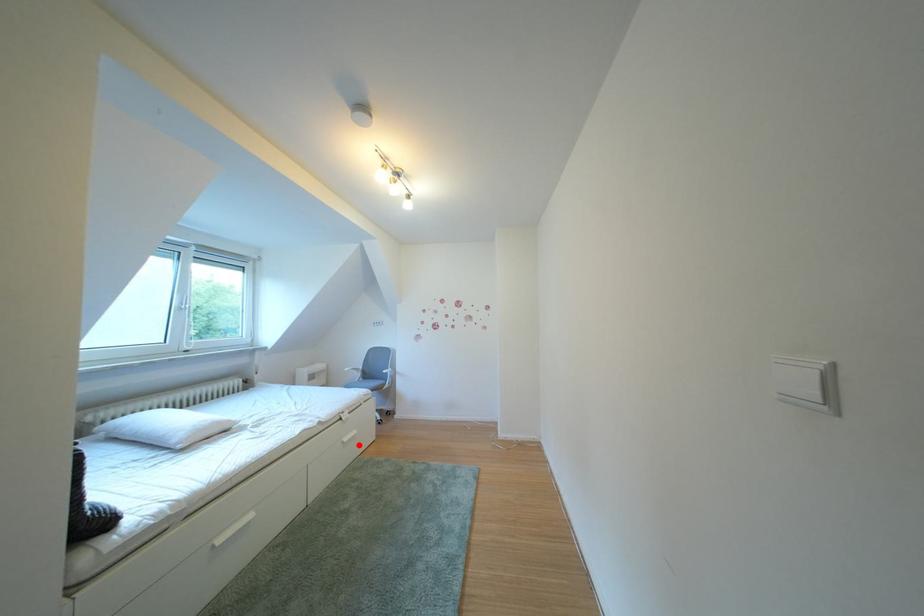
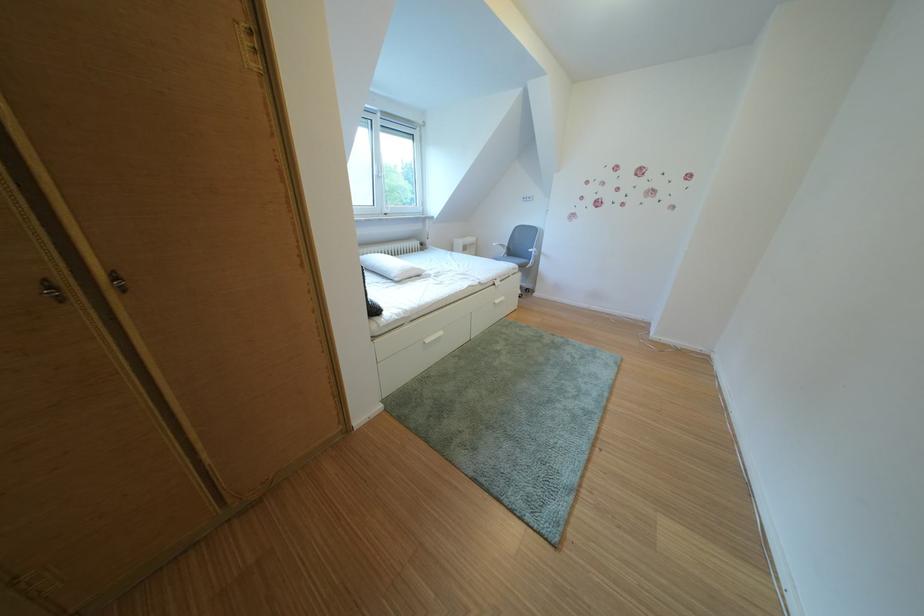
Question: I am providing you with two images of the same scene from different viewpoints. Image1 has a red point marked. In image2, the corresponding 3D location appears at what relative position? Reply with the corresponding letter.

Choices:
 (A) Closer
 (B) Farther

Answer: (B)